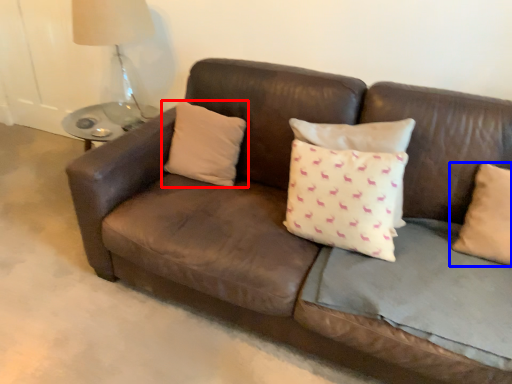
Question: Which of the following is the closest to the observer, pillow (highlighted by a red box) or pillow (highlighted by a blue box)?

Choices:
 (A) pillow
 (B) pillow

Answer: (B)